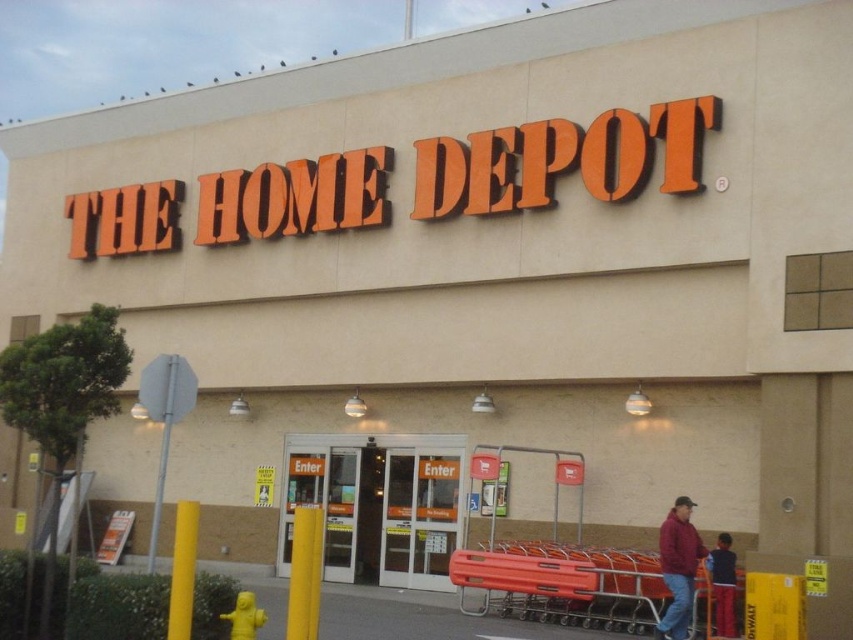
You are standing in front of the Home Depot store and notice two points marked on the facade. The first point is at coordinate point (392, 513) and the second is at point (689, 500). Which point is closer to you?

Point (392, 513) is further to the camera than point (689, 500), so the point closer to you is point (689, 500).

You are standing in front of the Home Depot store and want to enter through the clear glass doors at center. Based on the coordinates provided, can you determine if the doors are directly in front of you or to the side?

The clear glass doors at center are located at coordinates point (376, 506), which places them directly in front of you since they are centered in the image.